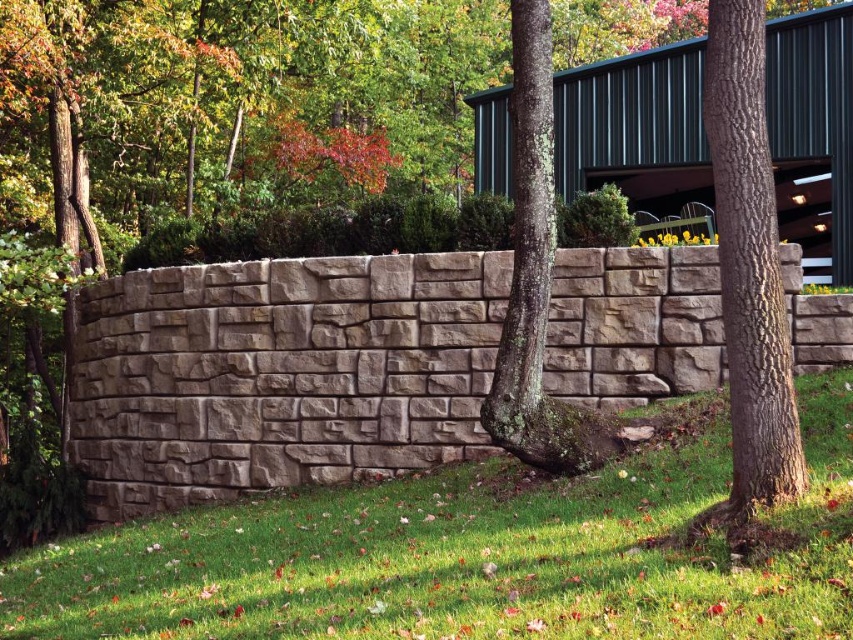
Is point (328, 474) positioned behind point (734, 472)?

Yes.

Who is higher up, gray stone wall at center or brown rough bark tree at center-right?

Positioned higher is brown rough bark tree at center-right.

Is point (267, 426) farther from camera compared to point (790, 378)?

Yes, point (267, 426) is farther from viewer.

At what (x,y) coordinates should I click in order to perform the action: click on gray stone wall at center. Please return your answer as a coordinate pair (x, y). This screenshot has width=853, height=640. Looking at the image, I should click on (281, 372).

Is green grass at center closer to camera compared to lichen-covered bark tree at center?

Yes.

Is green grass at center further to the viewer compared to lichen-covered bark tree at center?

No, green grass at center is closer to the viewer.

Between point (509, 632) and point (520, 326), which one is positioned in front?

Point (509, 632)

You are a GUI agent. You are given a task and a screenshot of the screen. Output one action in this format:
    pyautogui.click(x=<x>, y=<y>)
    Task: Click on the green grass at center
    This screenshot has height=640, width=853.
    Given the screenshot: What is the action you would take?
    pyautogui.click(x=467, y=556)

Measure the distance between point (531, 628) and camera.

The distance of point (531, 628) from camera is 13.58 feet.

Who is positioned more to the left, green grass at center or brown rough bark tree at center-right?

green grass at center

Image resolution: width=853 pixels, height=640 pixels. Find the location of `green grass at center`. green grass at center is located at coordinates (467, 556).

The height and width of the screenshot is (640, 853). I want to click on green grass at center, so click(x=467, y=556).